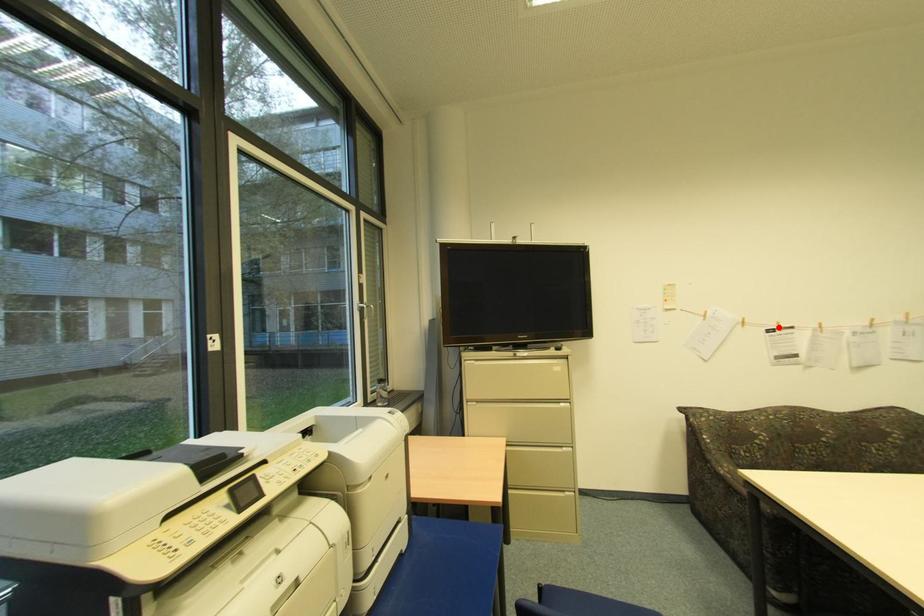
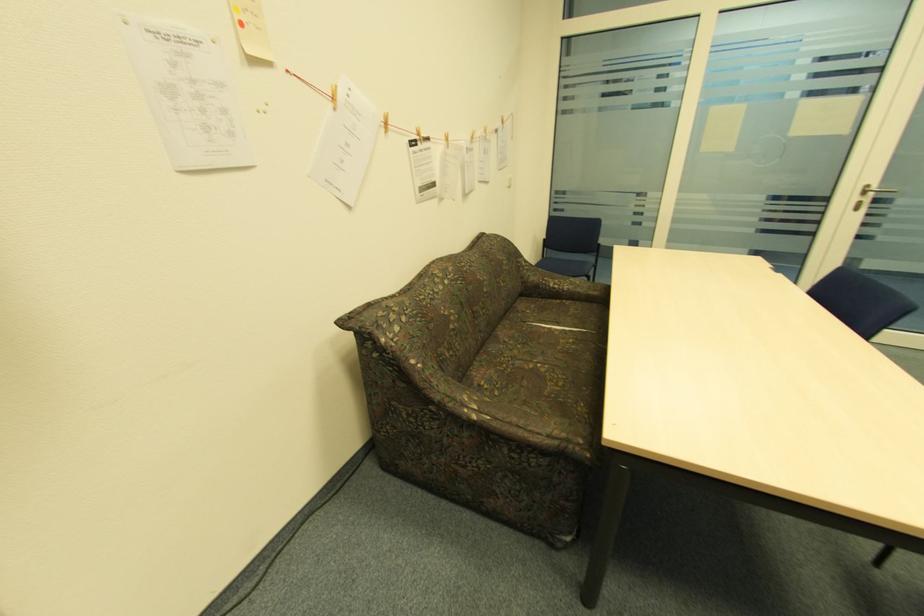
Find the pixel in the second image that matches the highlighted location in the first image.

(420, 138)